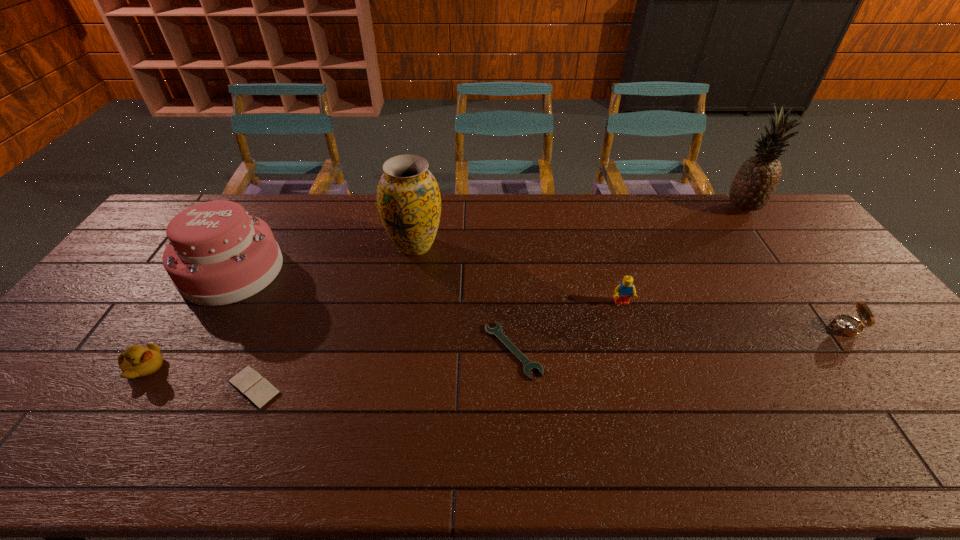
At what (x,y) coordinates should I click in order to perform the action: click on free area in between the sixth object from left to right and the duckling. Please return your answer as a coordinate pair (x, y). Looking at the image, I should click on (383, 335).

You are a GUI agent. You are given a task and a screenshot of the screen. Output one action in this format:
    pyautogui.click(x=<x>, y=<y>)
    Task: Click on the vacant space that is in between the second shortest object and the sixth object from left to right
    The image size is (960, 540).
    Given the screenshot: What is the action you would take?
    pyautogui.click(x=438, y=345)

Image resolution: width=960 pixels, height=540 pixels. What are the coordinates of `free area in between the seventh shortest object and the wrench` in the screenshot? It's located at coord(464,298).

Where is `vacant space that's between the fifth object from right to left and the cake`? The width and height of the screenshot is (960, 540). vacant space that's between the fifth object from right to left and the cake is located at coordinates 324,258.

Where is `empty space that is in between the third object from right to left and the shortest object`? This screenshot has height=540, width=960. empty space that is in between the third object from right to left and the shortest object is located at coordinates (567, 327).

Identify the location of vacant region between the duckling and the seventh tallest object. (200, 377).

The width and height of the screenshot is (960, 540). What are the coordinates of `vacant area that lies between the farthest object and the seventh shortest object` in the screenshot? It's located at (579, 227).

Locate an element on the screen. This screenshot has height=540, width=960. free point between the diary and the compass is located at coordinates (549, 357).

At what (x,y) coordinates should I click in order to perform the action: click on vacant space that is in between the fifth object from right to left and the tallest object. Please return your answer as a coordinate pair (x, y). The height and width of the screenshot is (540, 960). Looking at the image, I should click on (579, 227).

The height and width of the screenshot is (540, 960). I want to click on object that is the fourth closest to the farthest object, so click(408, 197).